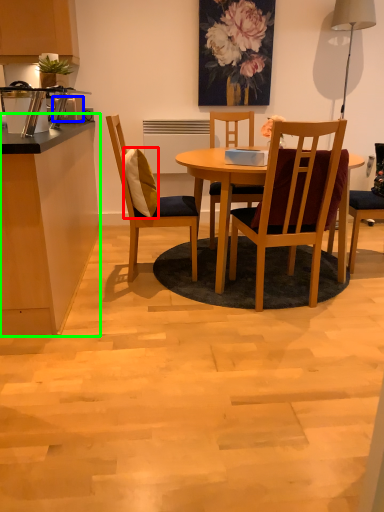
Question: Which is farther away from pillow (highlighted by a red box)? toaster (highlighted by a blue box) or counter top (highlighted by a green box)?

Choices:
 (A) toaster
 (B) counter top

Answer: (A)